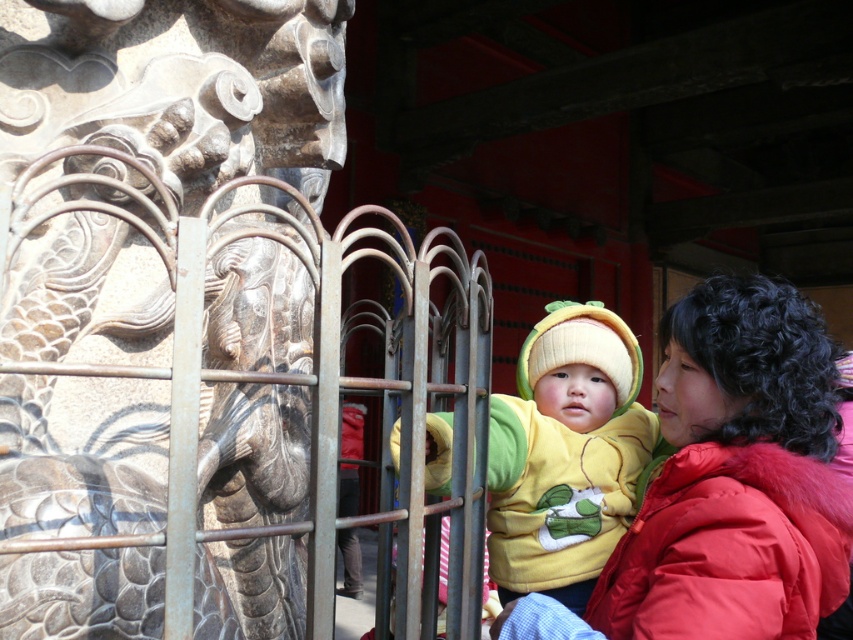
Question: Which point is farther to the camera?

Choices:
 (A) (677, 580)
 (B) (227, 269)
 (C) (503, 426)

Answer: (B)

Question: Can you confirm if stone dragon at center is positioned above yellow fleece at center?

Choices:
 (A) no
 (B) yes

Answer: (B)

Question: Which point is closer to the camera?

Choices:
 (A) yellow fleece at center
 (B) red puffy coat at right

Answer: (B)

Question: From the image, what is the correct spatial relationship of stone dragon at center in relation to yellow fleece at center?

Choices:
 (A) below
 (B) above

Answer: (B)

Question: In this image, where is stone dragon at center located relative to red puffy coat at right?

Choices:
 (A) above
 (B) below

Answer: (A)

Question: Which of the following is the closest to the observer?

Choices:
 (A) red puffy coat at right
 (B) yellow fleece at center
 (C) stone dragon at center

Answer: (C)